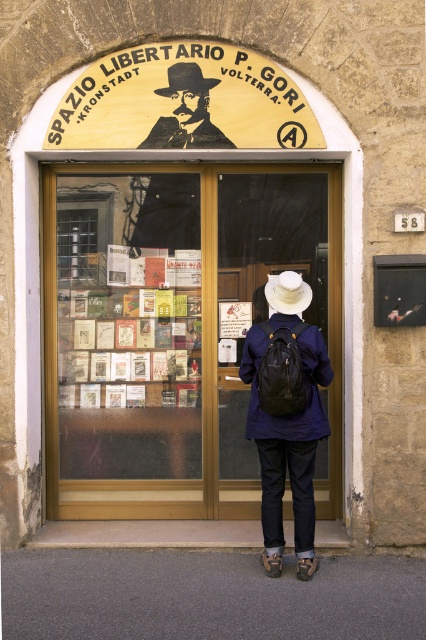
Question: Is transparent glass door at center above matte black suit at upper center?

Choices:
 (A) yes
 (B) no

Answer: (B)

Question: Does matte black suit at upper center have a greater width compared to matte blue jacket at center?

Choices:
 (A) yes
 (B) no

Answer: (A)

Question: Which of these objects is positioned closest to the dark blue fabric jacket at center?

Choices:
 (A) matte blue jacket at center
 (B) white felt cowboy hat at center
 (C) black matte portrait at center

Answer: (A)

Question: Is matte blue jacket at center below black matte portrait at center?

Choices:
 (A) no
 (B) yes

Answer: (B)

Question: Which point is farther to the camera?

Choices:
 (A) brown felt cowboy hat at center
 (B) matte blue jacket at center

Answer: (A)

Question: Considering the real-world distances, which object is closest to the black matte portrait at center?

Choices:
 (A) transparent glass door at center
 (B) matte blue jacket at center
 (C) brown felt cowboy hat at center

Answer: (C)